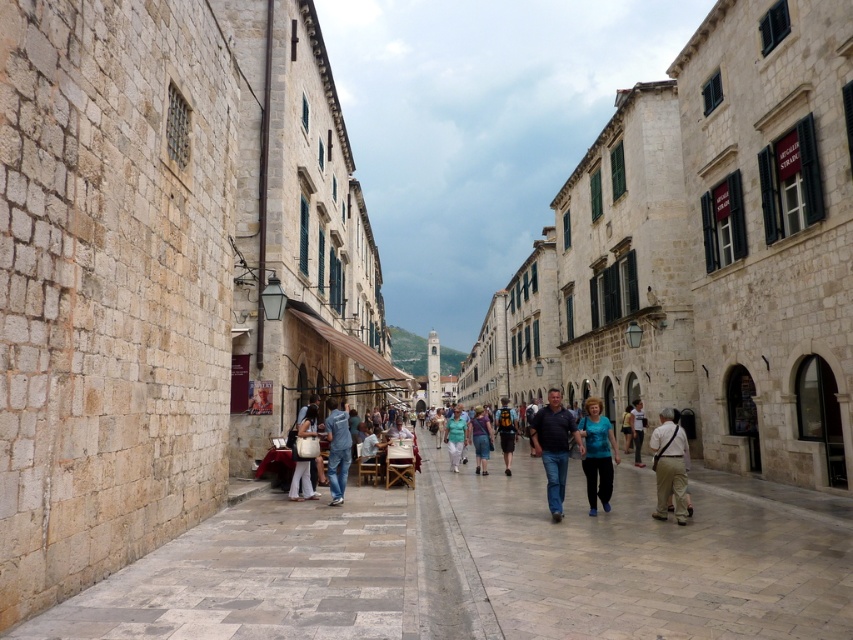
Question: Is khaki cotton pants at center positioned in front of light blue fabric dress at center?

Choices:
 (A) yes
 (B) no

Answer: (A)

Question: Where is blue denim jeans at center located in relation to light brown leather jacket at center in the image?

Choices:
 (A) above
 (B) below

Answer: (B)

Question: Among these points, which one is farthest from the camera?

Choices:
 (A) (636, 432)
 (B) (488, 429)

Answer: (A)

Question: Estimate the real-world distances between objects in this image. Which object is farther from the matte white bag at center?

Choices:
 (A) dark blue shirt at center
 (B) matte black backpack at center
 (C) smooth stone pavement at center

Answer: (B)

Question: Is smooth stone pavement at center below light blue fabric dress at center?

Choices:
 (A) no
 (B) yes

Answer: (A)

Question: Which object appears closest to the camera in this image?

Choices:
 (A) blue fabric shirt at center
 (B) light brown leather jacket at center
 (C) matte black backpack at center

Answer: (A)